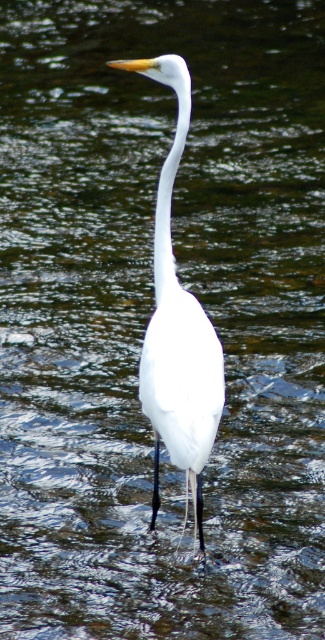
Is point (154, 376) less distant than point (168, 168)?

Yes, point (154, 376) is closer to viewer.

Looking at this image, is white smooth bird at center behind white smooth neck at center?

No, it is in front of white smooth neck at center.

The width and height of the screenshot is (325, 640). What are the coordinates of `white smooth bird at center` in the screenshot? It's located at (178, 324).